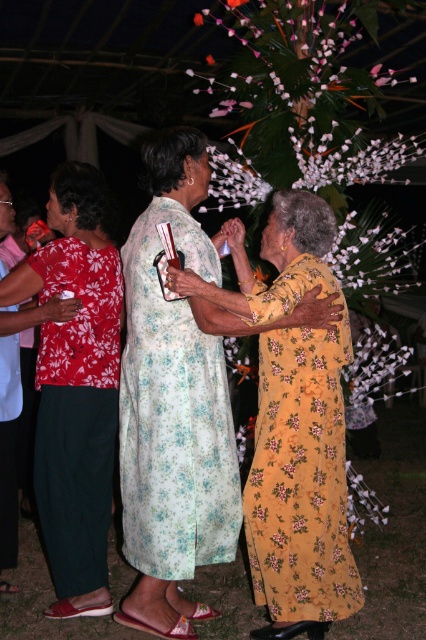
You are at a nighttime gathering under a tent and want to place a small decoration between the white floral garland at center and the white paper flower at center. Where should you place it so it is between them?

Place the decoration below the white floral garland at center and above the white paper flower at center since the white floral garland at center is above the white paper flower at center.

You are organizing a photoshoot and need to arrange two models wearing the floral cotton dress at center and the floral fabric dress at left. Based on the scene description, which dress is wider?

The floral cotton dress at center might be wider than the floral fabric dress at left according to the description.

You are a photographer at the event and want to take a photo of the floral fabric dress at left and the white floral garland at center. Which object should you focus on first to ensure both are in the frame?

The floral fabric dress at left is in front of the white floral garland at center, so you should focus on the white floral garland at center first to ensure both are in the frame.